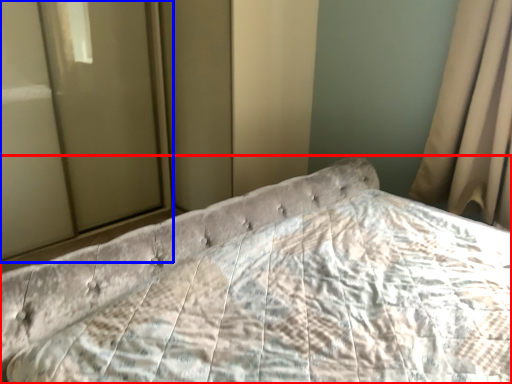
Question: Which of the following is the farthest to the observer, bed (highlighted by a red box) or glass door (highlighted by a blue box)?

Choices:
 (A) bed
 (B) glass door

Answer: (B)